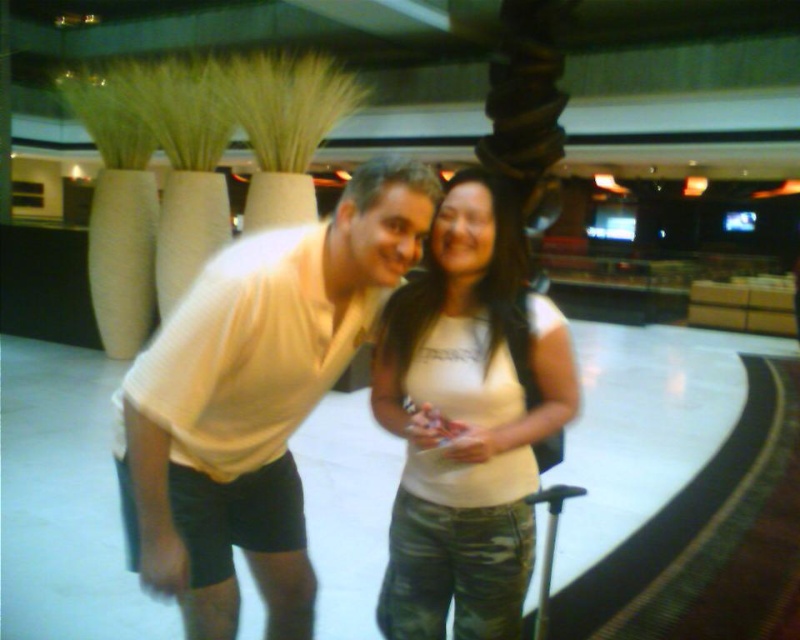
You are a security officer at the airport, and you need to check the items in the image. Which object, the white matte shirt at center or the camouflage fabric suitcase at lower right, is positioned higher from the ground?

The white matte shirt at center is located above the camouflage fabric suitcase at lower right, so the white matte shirt at center is positioned higher from the ground.

Consider the image. You are a fashion designer observing two people in an airport. You notice the white matte shirt at center and the white matte tank top at center. Which clothing item has a bigger size?

The white matte shirt at center is larger in size than the white matte tank top at center.

You are a photographer standing in front of the two people in the image. You want to take a clear photo of both the point at coordinates point (144, 547) and the point at coordinates point (542, 621). Which point should you focus on first to ensure both are in focus?

You should focus on point (144, 547) first because it is closer to the camera than point (542, 621). By focusing on the closer point, the farther point will also be within the depth of field, ensuring both are in focus.